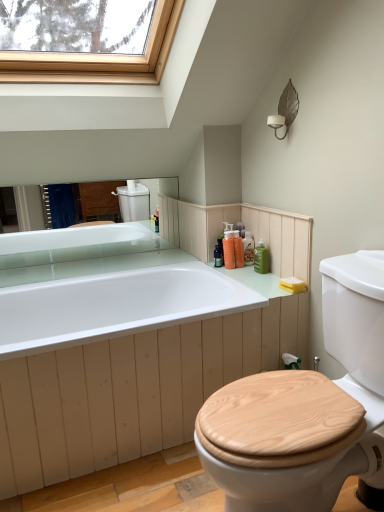
At what (x,y) coordinates should I click in order to perform the action: click on free region on the left part of yellow sponge at right. Please return your answer as a coordinate pair (x, y). This screenshot has height=512, width=384. Looking at the image, I should click on (268, 289).